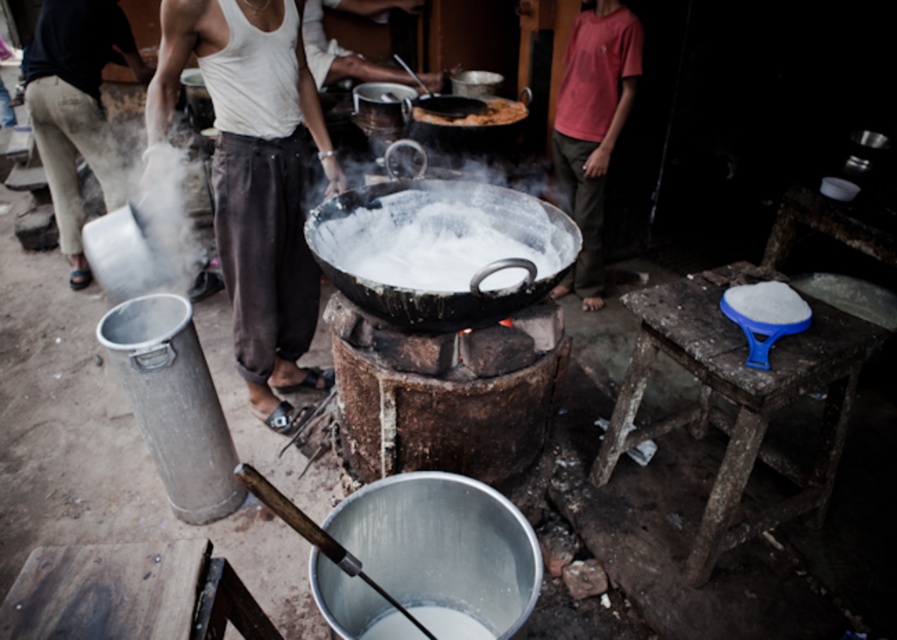
From the picture: You are a chef standing in the kitchen and you want to reach the point at coordinate (257, 179). Which object is at that coordinate?

The point at coordinate (257, 179) is on the white cotton tank top at center.